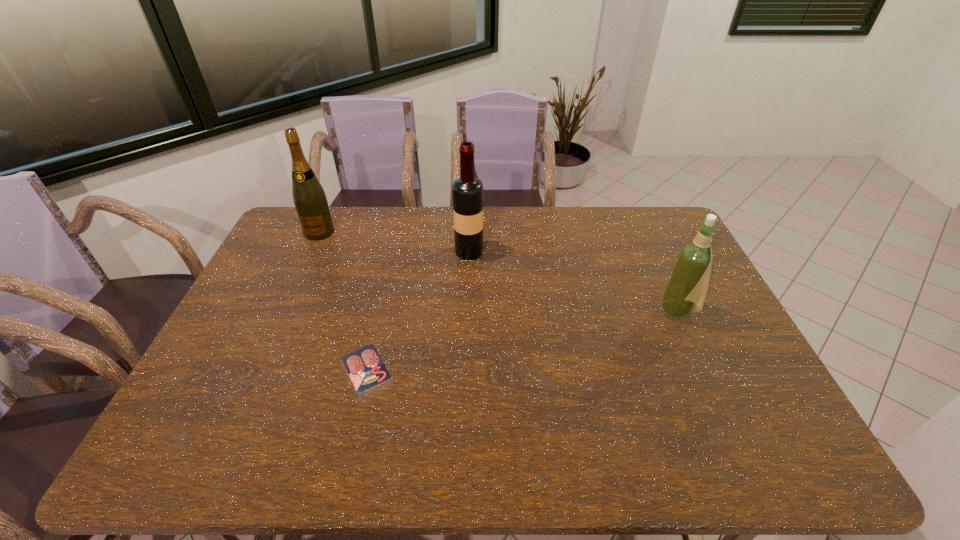
Find the location of `vacant space at the near left corner`. vacant space at the near left corner is located at coordinates (187, 453).

Identify the location of free space between the farthest object and the second farthest wine bottle. Image resolution: width=960 pixels, height=540 pixels. (395, 242).

Locate an element on the screen. The image size is (960, 540). free space between the second object from left to right and the leftmost wine bottle is located at coordinates (343, 300).

Identify the location of vacant point located between the third nearest object and the third object from right to left. The width and height of the screenshot is (960, 540). (418, 309).

I want to click on vacant area that lies between the third nearest object and the leftmost object, so click(395, 242).

The width and height of the screenshot is (960, 540). Find the location of `vacant point located between the rightmost wine bottle and the leftmost object`. vacant point located between the rightmost wine bottle and the leftmost object is located at coordinates (499, 272).

Image resolution: width=960 pixels, height=540 pixels. I want to click on unoccupied area between the nearest object and the second object from right to left, so click(418, 309).

You are a GUI agent. You are given a task and a screenshot of the screen. Output one action in this format:
    pyautogui.click(x=<x>, y=<y>)
    Task: Click on the vacant point located between the leftmost wine bottle and the second farthest object
    Image resolution: width=960 pixels, height=540 pixels.
    Given the screenshot: What is the action you would take?
    pyautogui.click(x=395, y=242)

Where is `unoccupied area between the salami and the second wine bottle from left to right`? The image size is (960, 540). unoccupied area between the salami and the second wine bottle from left to right is located at coordinates (418, 309).

You are a GUI agent. You are given a task and a screenshot of the screen. Output one action in this format:
    pyautogui.click(x=<x>, y=<y>)
    Task: Click on the vacant region between the nearest object and the farthest wine bottle
    
    Given the screenshot: What is the action you would take?
    pyautogui.click(x=343, y=300)